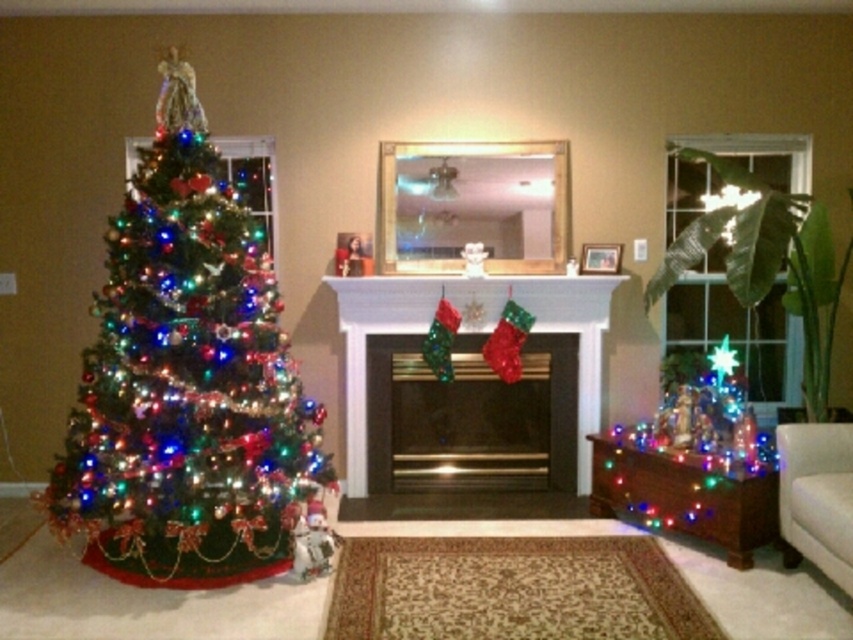
In the scene shown: You are standing in the living room and want to place a new ornament on the shiny green christmas tree at left. To reach the tree, you need to walk around the metallic gold fireplace at center. Which direction should you move relative to the fireplace?

Since the shiny green christmas tree at left is to the left of the metallic gold fireplace at center, you should move to the left side of the fireplace to reach the tree.

You are planning to place a large Christmas decoration on the mantel of the white glossy fireplace at center. Considering the space it occupies compared to the green leafy plant at right, will there be enough room for the decoration?

The white glossy fireplace at center occupies less space than the green leafy plant at right, so there might not be enough room for the large Christmas decoration on the mantel.

In the scene shown: You are standing in the living room and want to take a photo of both the Christmas tree and the stockings on the mantel. The stockings are located at point (496, 385) and the Christmas tree is at point (177, 186). Since you want both in the frame, will you need to adjust your camera angle to include both, considering their positions?

Point (177, 186) is closer to the camera than point (496, 385). To capture both the Christmas tree at point (177, 186) and the stockings at point (496, 385) in the same frame, you may need to adjust your camera angle to account for their different distances from the camera.